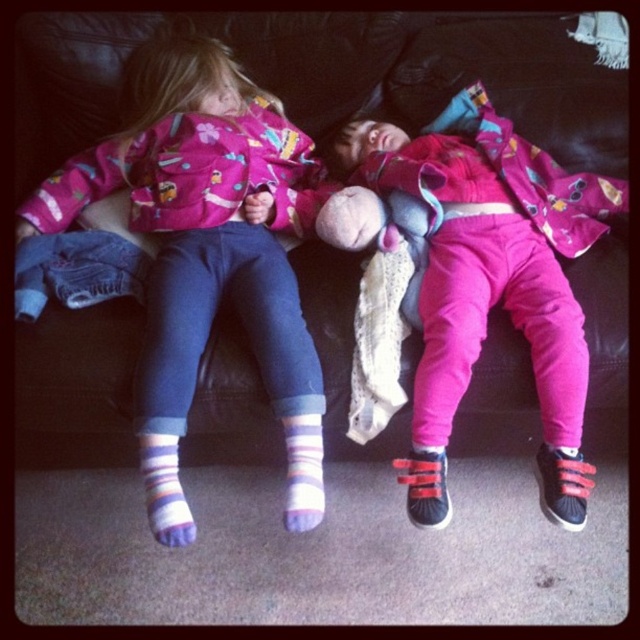
Does pink velour pants at center have a greater height compared to striped cotton sock at lower center?

Yes, pink velour pants at center is taller than striped cotton sock at lower center.

Between pink velour pants at center and striped cotton sock at lower center, which one has less height?

With less height is striped cotton sock at lower center.

The height and width of the screenshot is (640, 640). In order to click on pink velour pants at center in this screenshot , I will do `click(490, 280)`.

Where is `pink velour pants at center`? Image resolution: width=640 pixels, height=640 pixels. pink velour pants at center is located at coordinates (490, 280).

Is point (262, 336) in front of point (168, 483)?

No.

Is matte pink jacket at upper left to the right of striped cotton sock at lower left from the viewer's perspective?

Incorrect, matte pink jacket at upper left is not on the right side of striped cotton sock at lower left.

Does point (288, 156) come behind point (145, 468)?

Yes, point (288, 156) is farther from viewer.

The width and height of the screenshot is (640, 640). In order to click on matte pink jacket at upper left in this screenshot , I will do `click(202, 220)`.

Who is shorter, black leather couch at center or striped cotton sock at lower center?

With less height is striped cotton sock at lower center.

Is black leather couch at center below striped cotton sock at lower center?

Incorrect, black leather couch at center is not positioned below striped cotton sock at lower center.

Where is `black leather couch at center`? The image size is (640, 640). black leather couch at center is located at coordinates (436, 72).